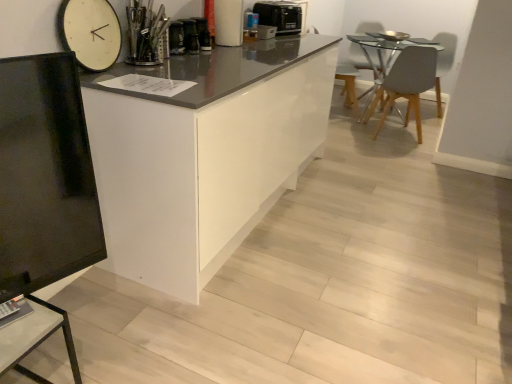
Question: Considering the positions of point (436, 92) and point (416, 59), is point (436, 92) closer or farther from the camera than point (416, 59)?

Choices:
 (A) closer
 (B) farther

Answer: (B)

Question: Relative to gray matte chair at right, is matte gray swivel chair at upper right, the 2th swivel chair positioned from the left, in front or behind?

Choices:
 (A) behind
 (B) front

Answer: (A)

Question: Which object is the farthest from the gray matte chair at right?

Choices:
 (A) white wooden clock at upper left
 (B) matte gray swivel chair at upper right, the first swivel chair viewed from the right
 (C) matte black tv stand at lower left
 (D) matte gray swivel chair at upper right, the second swivel chair from the right
 (E) white glossy cabinet at center

Answer: (C)

Question: Which object is the closest to the black plastic toaster at upper center?

Choices:
 (A) matte black tv stand at lower left
 (B) white glossy cabinet at center
 (C) white wooden clock at upper left
 (D) matte gray swivel chair at upper right, the first swivel chair in the left-to-right sequence
 (E) matte gray swivel chair at upper right, the first swivel chair viewed from the right

Answer: (B)